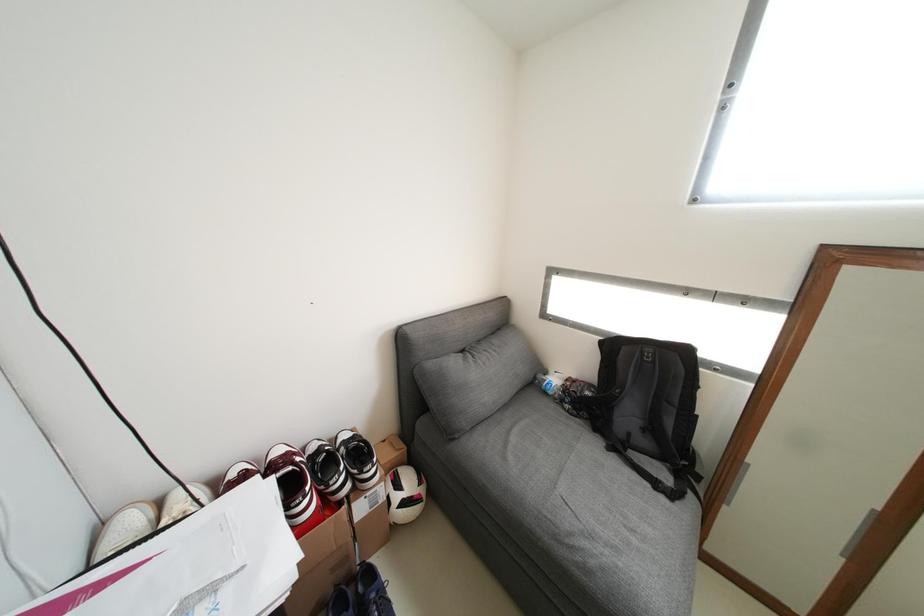
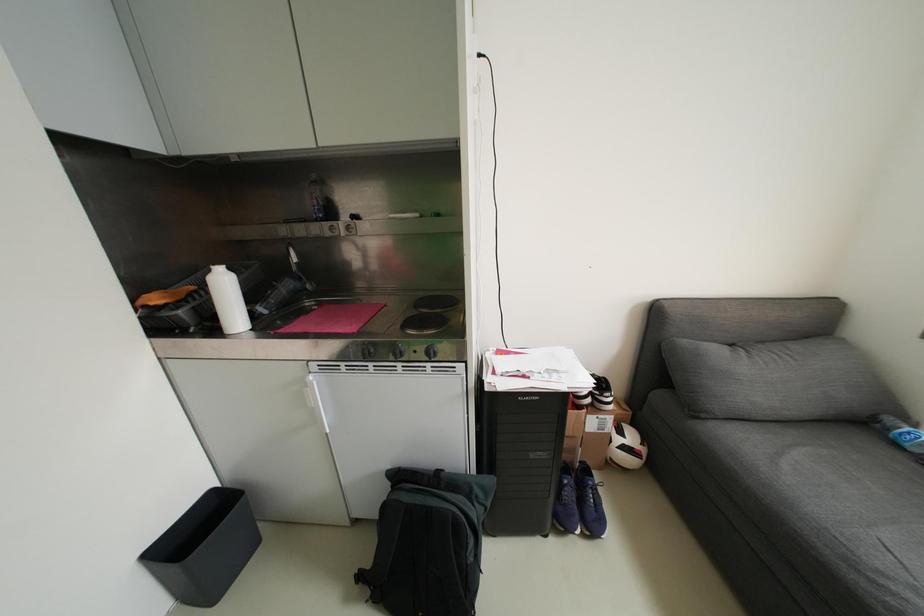
Question: The images are taken continuously from a first-person perspective. In which direction is your viewpoint rotating?

Choices:
 (A) Left
 (B) Right
 (C) Up
 (D) Down

Answer: (A)